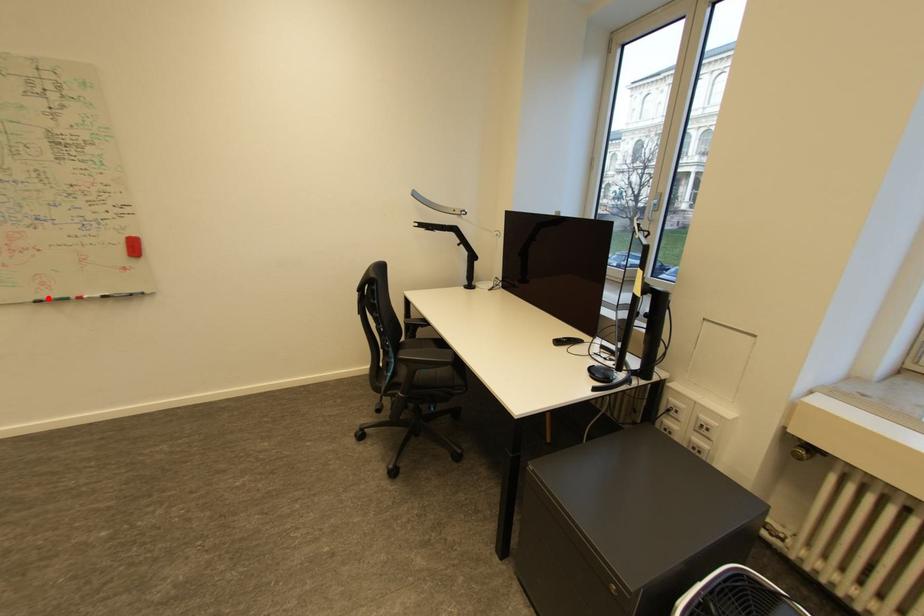
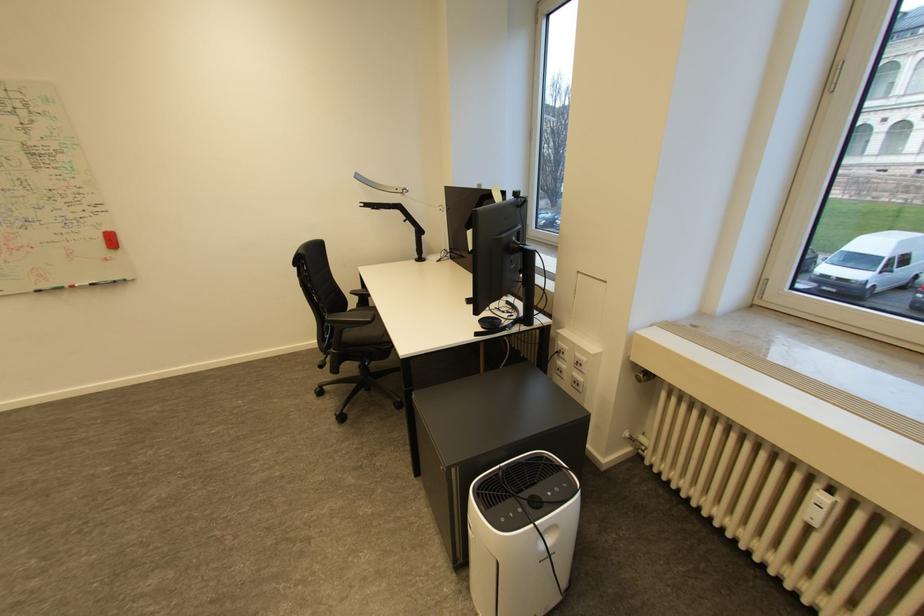
Find the pixel in the second image that matches the highlighted location in the first image.

(47, 288)